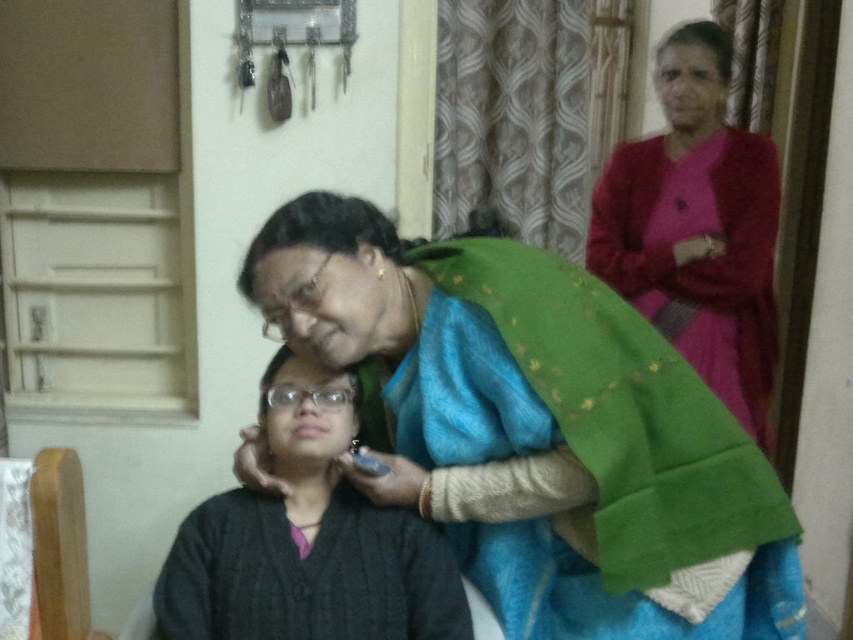
Based on the scene description, can you determine which object is closer to the viewer between the green silk saree at center and the black knitted robe at lower center?

The green silk saree at center is closer to the viewer than the black knitted robe at lower center because it is described as being in front of it.

You are a photographer setting up a shoot in this room. You need to position a light source so that it illuminates the green silk saree at center without affecting the matte pink robe at upper right. Based on their positions, where should you place the light?

The green silk saree at center is in front of the matte pink robe at upper right. To illuminate the green silk saree at center without affecting the matte pink robe at upper right, position the light source in front of the green silk saree at center so that the matte pink robe at upper right is behind it and thus not directly lit.

You are a tailor measuring the distance between two garments in the room. The green silk saree at center and the matte pink robe at upper right need to be placed on a rack. Can you fit both on a rack that is 36 inches wide?

The distance between the green silk saree at center and matte pink robe at upper right is 36.40 inches, which is slightly longer than the rack. Therefore, they cannot both fit on the rack.